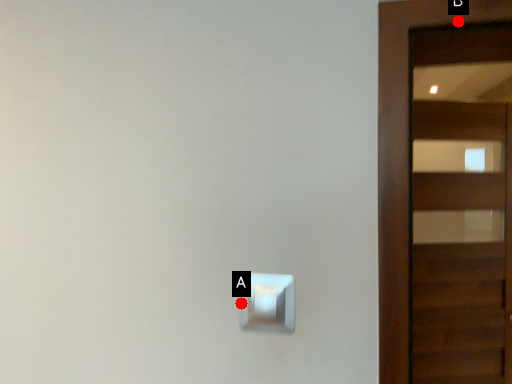
Question: Two points are circled on the image, labeled by A and B beside each circle. Among these points, which one is farthest from the camera?

Choices:
 (A) A is further
 (B) B is further

Answer: (A)